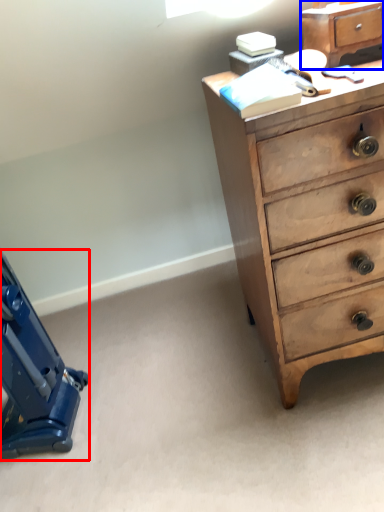
Question: Among these objects, which one is nearest to the camera, equipment (highlighted by a red box) or file cabinet (highlighted by a blue box)?

Choices:
 (A) equipment
 (B) file cabinet

Answer: (B)